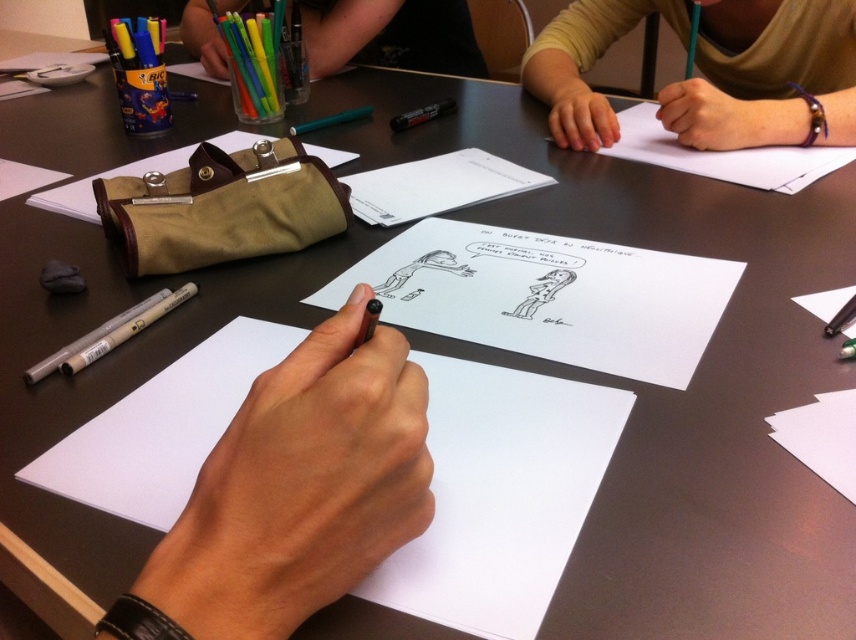
You are standing at the table and want to place a sticker on the table. You have two points marked on the table surface. Which point is closer to you, point (696, 120) or point (217, 58)?

Point (217, 58) is closer to you because it is behind point (696, 120), which is in front.

You are organizing supplies on a table and need to stack the matte beige pencil case at upper center and the matte plastic pen at upper center vertically. Which object should you place at the bottom to ensure stability?

The matte beige pencil case at upper center should be placed at the bottom because it has a greater height than the matte plastic pen at upper center, providing a stable base.

You are an artist trying to place a new drawing tool on the table. The table has a coordinate system where the bottom left corner is the origin. The matte skin hand at upper right is currently at position 0.180, 0.675. If you want to place the tool 0.1 units to the left of the hand, what would be the coordinate of the new position?

The new position would be at coordinate x 0.080, y 0.675.